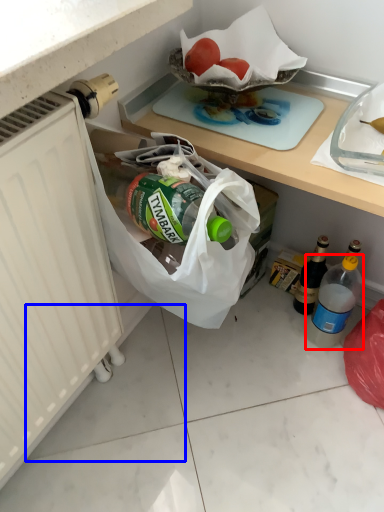
Question: Which object appears closest to the camera in this image, bottle (highlighted by a red box) or tile (highlighted by a blue box)?

Choices:
 (A) bottle
 (B) tile

Answer: (B)